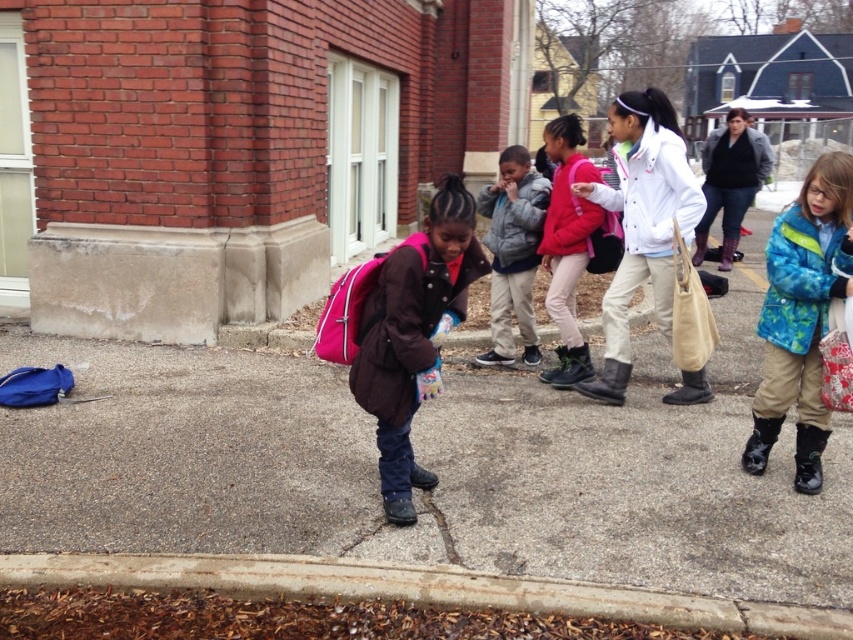
You are standing on the sidewalk and see a blue bag. Where should you look to find the concrete at lower left?

The concrete at lower left is located at point [416,588].

You are a parent trying to identify your child in a group photo. You know your child is wearing either the blue fleece jacket at right or the white matte jacket at center. Which jacket should you look for if your child is the taller one?

The blue fleece jacket at right has a larger size compared to white matte jacket at center, so you should look for the blue fleece jacket at right since it is worn by the taller child.